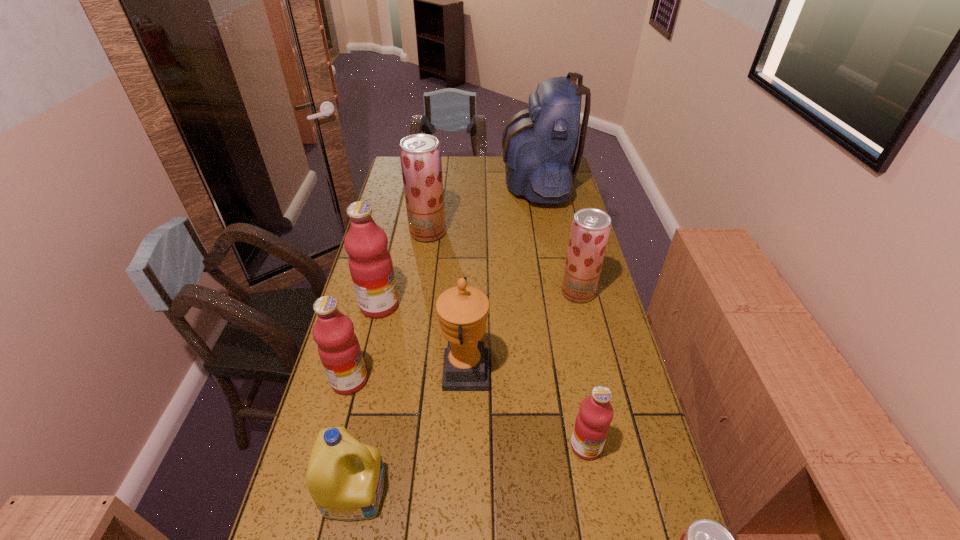
Identify the location of detergent. (345, 478).

Image resolution: width=960 pixels, height=540 pixels. I want to click on the nearest pink fruit juice, so click(592, 424).

This screenshot has width=960, height=540. I want to click on the fifth farthest fruit juice, so click(x=592, y=424).

Locate an element on the screen. The width and height of the screenshot is (960, 540). free spot located 0.340m at the front pocket of the backpack is located at coordinates (426, 184).

I want to click on free spot located at the front pocket of the backpack, so click(477, 184).

In order to click on free space located 0.190m at the front pocket of the backpack in this screenshot , I will do `click(460, 184)`.

This screenshot has height=540, width=960. What are the coordinates of `free space located on the back of the leftmost strawberry fruit juice` in the screenshot? It's located at (431, 211).

The width and height of the screenshot is (960, 540). What are the coordinates of `free region located on the label of the farthest pink fruit juice` in the screenshot? It's located at (464, 306).

You are a GUI agent. You are given a task and a screenshot of the screen. Output one action in this format:
    pyautogui.click(x=<x>, y=<y>)
    Task: Click on the free space located 0.300m at the front of the fifth object from left to right with handles
    Image resolution: width=960 pixels, height=540 pixels.
    Given the screenshot: What is the action you would take?
    pyautogui.click(x=596, y=372)

Where is `vacant space situated on the back of the second smallest strawberry fruit juice`? vacant space situated on the back of the second smallest strawberry fruit juice is located at coordinates (560, 217).